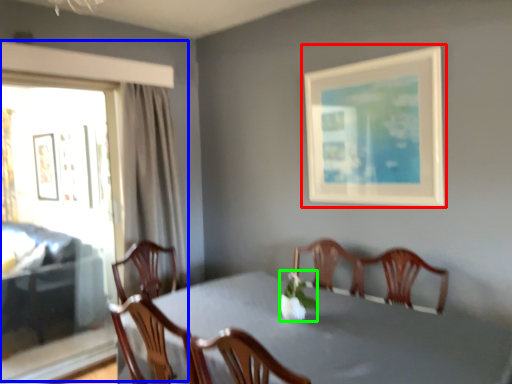
Question: Considering the real-world distances, which object is closest to picture frame (highlighted by a red box)? window (highlighted by a blue box) or floral arrangement (highlighted by a green box).

Choices:
 (A) window
 (B) floral arrangement

Answer: (B)